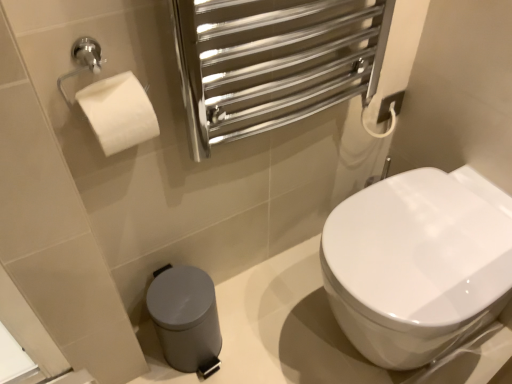
Question: Is the depth of satin grey plastic trash can at lower left greater than that of white glossy toilet at center?

Choices:
 (A) no
 (B) yes

Answer: (B)

Question: From the image's perspective, would you say satin grey plastic trash can at lower left is positioned over white glossy toilet at center?

Choices:
 (A) yes
 (B) no

Answer: (B)

Question: From the image's perspective, is satin grey plastic trash can at lower left below white glossy toilet at center?

Choices:
 (A) yes
 (B) no

Answer: (A)

Question: Is satin grey plastic trash can at lower left with white glossy toilet at center?

Choices:
 (A) yes
 (B) no

Answer: (B)

Question: Is satin grey plastic trash can at lower left outside of white glossy toilet at center?

Choices:
 (A) yes
 (B) no

Answer: (A)

Question: Is the depth of satin grey plastic trash can at lower left less than that of white glossy toilet at center?

Choices:
 (A) yes
 (B) no

Answer: (B)

Question: Does white glossy toilet at center appear on the right side of satin grey plastic trash can at lower left?

Choices:
 (A) no
 (B) yes

Answer: (B)

Question: Is satin grey plastic trash can at lower left located within white glossy toilet at center?

Choices:
 (A) yes
 (B) no

Answer: (B)

Question: From a real-world perspective, is white glossy toilet at center on top of satin grey plastic trash can at lower left?

Choices:
 (A) no
 (B) yes

Answer: (B)

Question: Does white glossy toilet at center come behind satin grey plastic trash can at lower left?

Choices:
 (A) yes
 (B) no

Answer: (B)

Question: Considering the relative sizes of white glossy toilet at center and satin grey plastic trash can at lower left in the image provided, is white glossy toilet at center taller than satin grey plastic trash can at lower left?

Choices:
 (A) yes
 (B) no

Answer: (A)

Question: Would you consider white glossy toilet at center to be distant from satin grey plastic trash can at lower left?

Choices:
 (A) yes
 (B) no

Answer: (B)

Question: From the image's perspective, is white glossy toilet at center positioned above or below satin grey plastic trash can at lower left?

Choices:
 (A) above
 (B) below

Answer: (A)